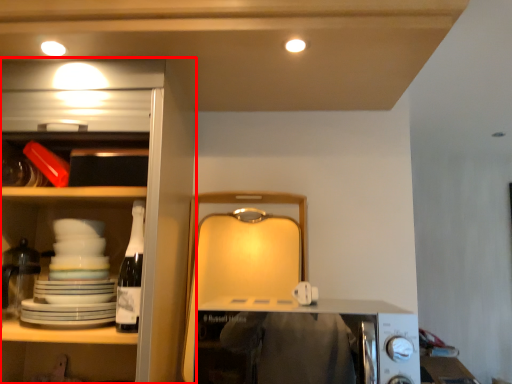
Question: From the image's perspective, what is the correct spatial relationship of cabinetry (annotated by the red box) in relation to appliance?

Choices:
 (A) below
 (B) above

Answer: (B)